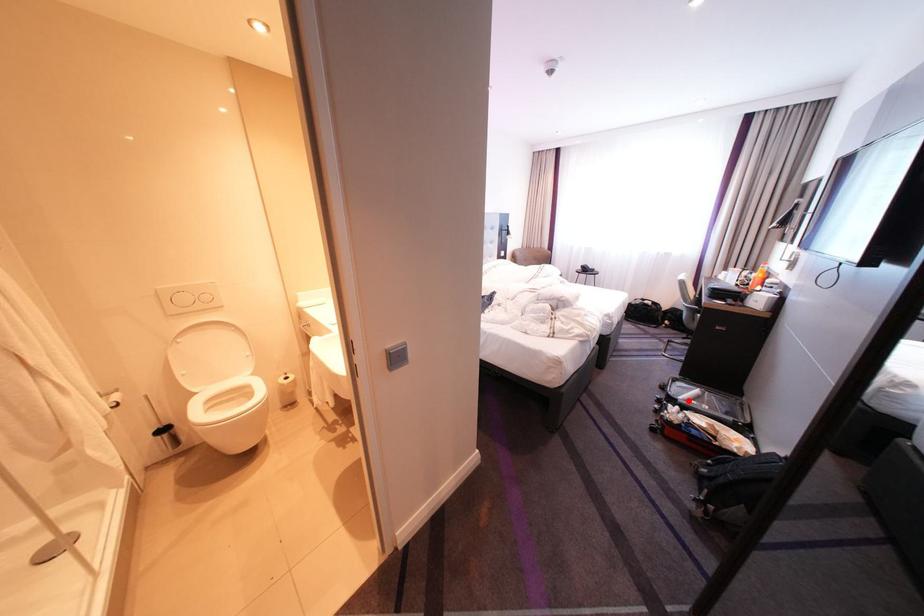
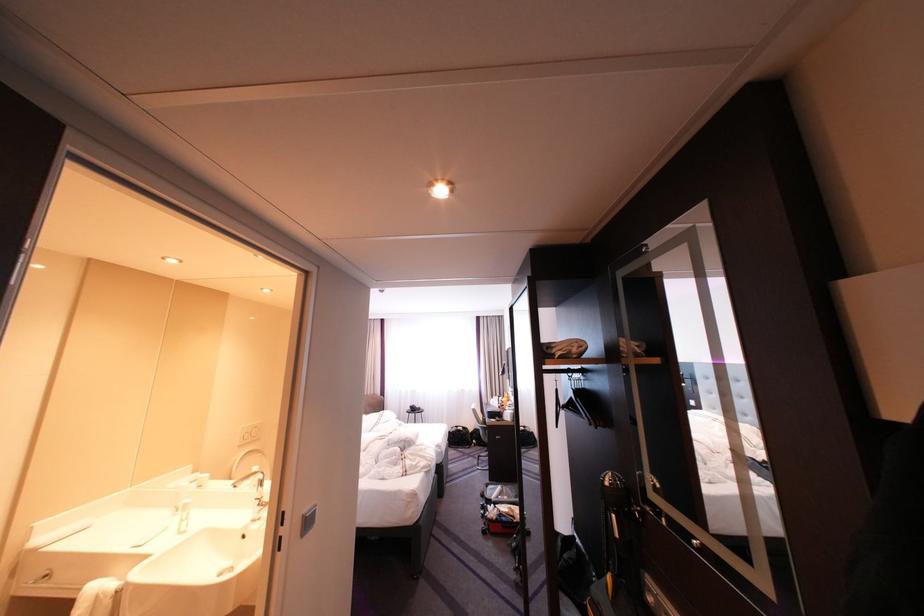
Question: A red point is marked in image1. In image2, is the corresponding 3D point closer to the camera or farther? Reply with the corresponding letter.

Choices:
 (A) The corresponding 3D point is closer.
 (B) The corresponding 3D point is farther.

Answer: (B)